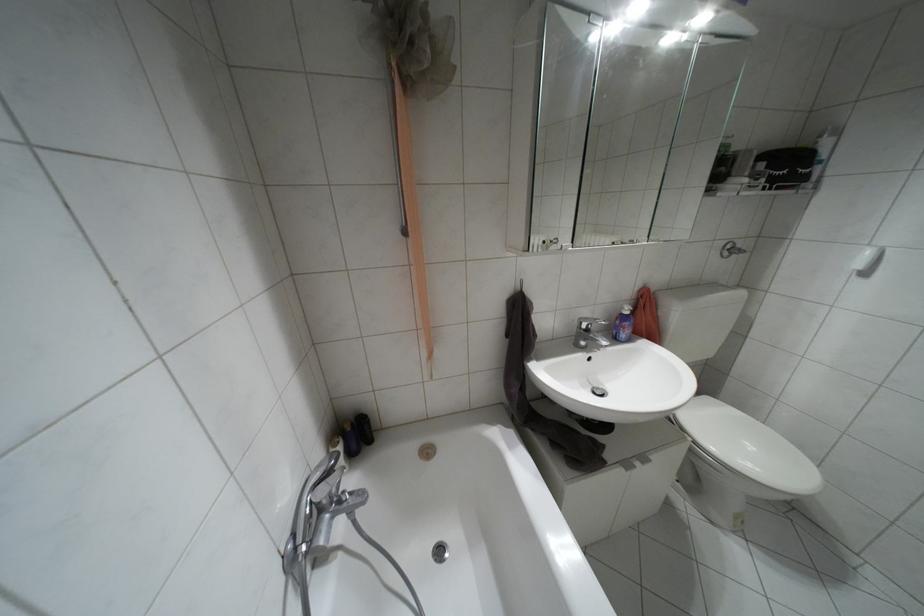
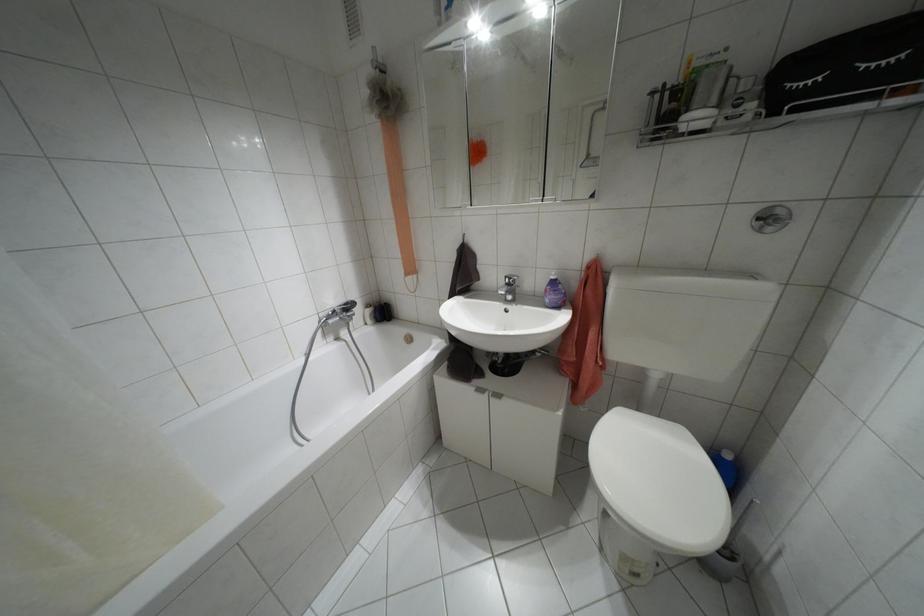
Locate, in the second image, the point that corresponds to pixel 723 254 in the first image.

(769, 228)